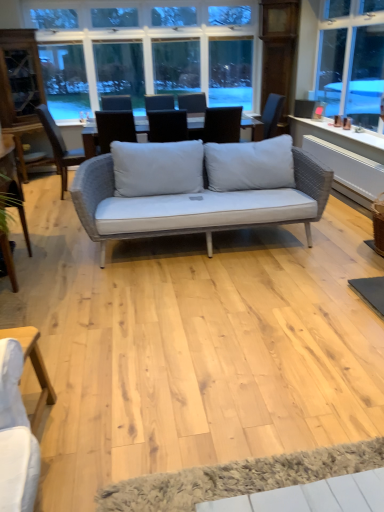
The image size is (384, 512). Describe the element at coordinates (59, 146) in the screenshot. I see `woven fabric chair at center, positioned as the second chair in right-to-left order` at that location.

Looking at this image, measure the distance between clear glass window at upper center and camera.

They are 4.93 meters apart.

Describe the element at coordinates (238, 478) in the screenshot. The image size is (384, 512). I see `white textured yoga mat at lower center` at that location.

Where is `matte gray cushion at center, arranged as the 1th chair when viewed from the right`? The width and height of the screenshot is (384, 512). matte gray cushion at center, arranged as the 1th chair when viewed from the right is located at coordinates (x=167, y=126).

What is the approximate width of matte gray cushion at center, the 2th chair viewed from the left?

It is 23.19 inches.

Measure the distance between matte gray wicker armchair at upper right and camera.

The depth of matte gray wicker armchair at upper right is 5.19 meters.

Find the location of a particular element. woven fabric chair at center, which is counted as the first chair, starting from the left is located at coordinates (59, 146).

From the picture: Can you confirm if matte gray cushion at center, the 2th chair viewed from the left, is wider than matte gray wicker armchair at upper right?

Yes.

Considering the positions of point (149, 125) and point (314, 104), is point (149, 125) closer or farther from the camera than point (314, 104)?

Point (149, 125) appears to be closer to the viewer than point (314, 104).

From a real-world perspective, which is physically above, matte gray cushion at center, arranged as the 1th chair when viewed from the right, or matte gray wicker armchair at upper right?

In real-world perspective, matte gray cushion at center, arranged as the 1th chair when viewed from the right, is above.

Does matte gray cushion at center, arranged as the 1th chair when viewed from the right, appear on the right side of matte gray wicker armchair at upper right?

No, matte gray cushion at center, arranged as the 1th chair when viewed from the right, is not to the right of matte gray wicker armchair at upper right.

Does light wood table at lower left contain clear glass window at upper center?

No.

Considering their positions, is light wood table at lower left located in front of or behind clear glass window at upper center?

light wood table at lower left is in front of clear glass window at upper center.

From the image's perspective, is light wood table at lower left located beneath clear glass window at upper center?

Correct, light wood table at lower left appears lower than clear glass window at upper center in the image.

From the image's perspective, is white textured yoga mat at lower center beneath clear glass window at upper center?

Yes, from the image's perspective, white textured yoga mat at lower center is beneath clear glass window at upper center.

Is white textured yoga mat at lower center behind clear glass window at upper center?

No.

Does white textured yoga mat at lower center have a greater height compared to clear glass window at upper center?

Incorrect, the height of white textured yoga mat at lower center is not larger of that of clear glass window at upper center.

From a real-world perspective, is white textured yoga mat at lower center physically located above or below clear glass window at upper center?

In terms of real-world spatial position, white textured yoga mat at lower center is below clear glass window at upper center.

Is light wood table at lower left turned away from matte gray wicker armchair at upper right?

No, matte gray wicker armchair at upper right is not at the back of light wood table at lower left.

Is light wood table at lower left not within matte gray wicker armchair at upper right?

Yes, light wood table at lower left is not within matte gray wicker armchair at upper right.

Consider the image. How different are the orientations of light wood table at lower left and matte gray wicker armchair at upper right in degrees?

The angle between the facing direction of light wood table at lower left and the facing direction of matte gray wicker armchair at upper right is 142 degrees.

Identify the location of table below the matte gray wicker armchair at upper right (from a real-world perspective). (33, 367).

Where is `the 1st chair in front of the matte gray wicker armchair at upper right, starting your count from the anchor`? Image resolution: width=384 pixels, height=512 pixels. the 1st chair in front of the matte gray wicker armchair at upper right, starting your count from the anchor is located at coordinates pyautogui.click(x=59, y=146).

Can you confirm if matte gray wicker armchair at upper right is positioned to the right of woven fabric chair at center, positioned as the second chair in right-to-left order?

Correct, you'll find matte gray wicker armchair at upper right to the right of woven fabric chair at center, positioned as the second chair in right-to-left order.

Considering the positions of objects matte gray wicker armchair at upper right and woven fabric chair at center, which is counted as the first chair, starting from the left, in the image provided, who is behind, matte gray wicker armchair at upper right or woven fabric chair at center, which is counted as the first chair, starting from the left,?

matte gray wicker armchair at upper right is further away from the camera.

How distant is matte gray wicker armchair at upper right from woven fabric chair at center, which is counted as the first chair, starting from the left?

matte gray wicker armchair at upper right and woven fabric chair at center, which is counted as the first chair, starting from the left, are 2.86 meters apart from each other.

Could you tell me if woven fabric chair at center, positioned as the second chair in right-to-left order, is turned towards white textured yoga mat at lower center?

No, woven fabric chair at center, positioned as the second chair in right-to-left order, is not oriented towards white textured yoga mat at lower center.

Considering the relative sizes of woven fabric chair at center, which is counted as the first chair, starting from the left, and white textured yoga mat at lower center in the image provided, is woven fabric chair at center, which is counted as the first chair, starting from the left, wider than white textured yoga mat at lower center?

Correct, the width of woven fabric chair at center, which is counted as the first chair, starting from the left, exceeds that of white textured yoga mat at lower center.

From a real-world perspective, does woven fabric chair at center, which is counted as the first chair, starting from the left, sit lower than white textured yoga mat at lower center?

Incorrect, from a real-world perspective, woven fabric chair at center, which is counted as the first chair, starting from the left, is higher than white textured yoga mat at lower center.

Considering the positions of points (36, 111) and (141, 479), is point (36, 111) farther from camera compared to point (141, 479)?

That is True.

Is white textured yoga mat at lower center inside matte gray cushion at center, arranged as the 1th chair when viewed from the right?

That's incorrect, white textured yoga mat at lower center is not inside matte gray cushion at center, arranged as the 1th chair when viewed from the right.

Considering the relative sizes of matte gray cushion at center, the 2th chair viewed from the left, and white textured yoga mat at lower center in the image provided, is matte gray cushion at center, the 2th chair viewed from the left, taller than white textured yoga mat at lower center?

Indeed, matte gray cushion at center, the 2th chair viewed from the left, has a greater height compared to white textured yoga mat at lower center.

From a real-world perspective, is matte gray cushion at center, the 2th chair viewed from the left, positioned over white textured yoga mat at lower center based on gravity?

Yes, from a real-world perspective, matte gray cushion at center, the 2th chair viewed from the left, is over white textured yoga mat at lower center

Does matte gray cushion at center, arranged as the 1th chair when viewed from the right, have a larger size compared to white textured yoga mat at lower center?

Yes.

Image resolution: width=384 pixels, height=512 pixels. What are the coordinates of `armchair to the right of matte gray cushion at center, the 2th chair viewed from the left` in the screenshot? It's located at pyautogui.click(x=305, y=108).

Find the location of `window that is above the light wood table at lower left (from a real-world perspective)`. window that is above the light wood table at lower left (from a real-world perspective) is located at coordinates (159, 46).

Looking at this image, based on their spatial positions, is matte gray cushion at center, the 2th chair viewed from the left, or light wood table at lower left closer to white textured yoga mat at lower center?

light wood table at lower left is closer to white textured yoga mat at lower center.

Estimate the real-world distances between objects in this image. Which object is closer to woven fabric chair at center, positioned as the second chair in right-to-left order, matte gray cushion at center, arranged as the 1th chair when viewed from the right, or white textured yoga mat at lower center?

matte gray cushion at center, arranged as the 1th chair when viewed from the right, lies closer to woven fabric chair at center, positioned as the second chair in right-to-left order, than the other object.

Looking at this image, based on their spatial positions, is light wood table at lower left or matte gray cushion at center, the 2th chair viewed from the left, closer to white textured yoga mat at lower center?

The object closer to white textured yoga mat at lower center is light wood table at lower left.

Looking at this image, estimate the real-world distances between objects in this image. Which object is closer to white textured yoga mat at lower center, light wood table at lower left or woven fabric chair at center, positioned as the second chair in right-to-left order?

light wood table at lower left.

Which object lies further to the anchor point woven fabric chair at center, positioned as the second chair in right-to-left order, light wood table at lower left or matte gray cushion at center, the 2th chair viewed from the left?

The object further to woven fabric chair at center, positioned as the second chair in right-to-left order, is light wood table at lower left.

Estimate the real-world distances between objects in this image. Which object is further from woven fabric chair at center, positioned as the second chair in right-to-left order, light wood table at lower left or white textured yoga mat at lower center?

white textured yoga mat at lower center.

When comparing their distances from white textured yoga mat at lower center, does light wood table at lower left or matte gray wicker armchair at upper right seem further?

matte gray wicker armchair at upper right is positioned further to the anchor white textured yoga mat at lower center.

Based on their spatial positions, is matte gray wicker armchair at upper right or white textured yoga mat at lower center further from matte gray cushion at center, the 2th chair viewed from the left?

The object further to matte gray cushion at center, the 2th chair viewed from the left, is white textured yoga mat at lower center.

Where is `window between light wood table at lower left and matte gray wicker armchair at upper right from front to back`? This screenshot has width=384, height=512. window between light wood table at lower left and matte gray wicker armchair at upper right from front to back is located at coordinates (159, 46).

Locate an element on the screen. Image resolution: width=384 pixels, height=512 pixels. table between white textured yoga mat at lower center and woven fabric chair at center, which is counted as the first chair, starting from the left, along the z-axis is located at coordinates (33, 367).

The image size is (384, 512). What are the coordinates of `chair between clear glass window at upper center and matte gray wicker armchair at upper right from left to right` in the screenshot? It's located at (167, 126).

Identify the location of table between white textured yoga mat at lower center and clear glass window at upper center in the front-back direction. (33, 367).